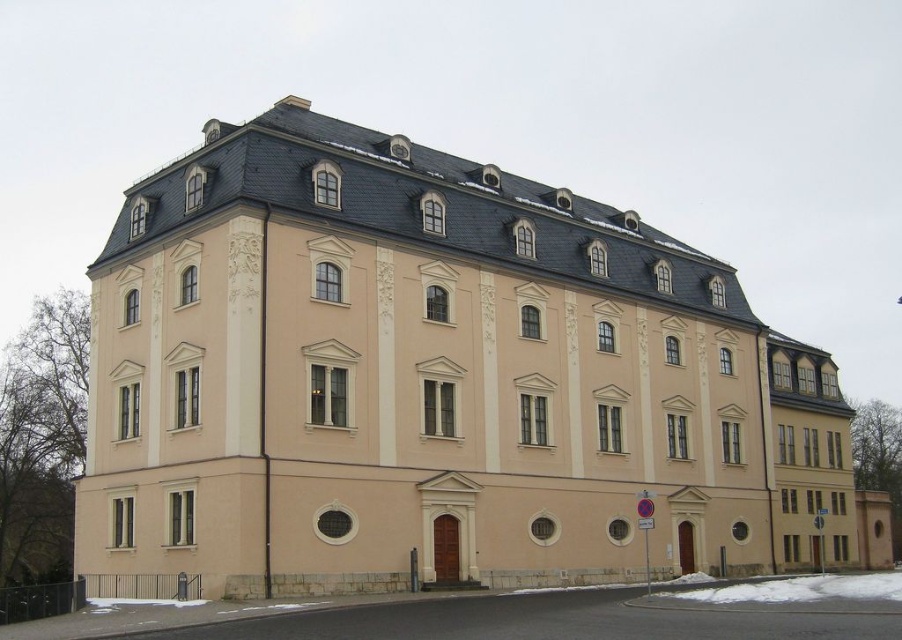
Does beige stone building at center have a lesser height compared to white powdery snow at lower center?

Incorrect, beige stone building at center's height does not fall short of white powdery snow at lower center's.

From the picture: Does beige stone building at center have a lesser width compared to white powdery snow at lower center?

No.

Is point (827, 401) behind point (775, 602)?

Yes, it is behind point (775, 602).

At what (x,y) coordinates should I click in order to perform the action: click on beige stone building at center. Please return your answer as a coordinate pair (x, y). The height and width of the screenshot is (640, 902). Looking at the image, I should click on (433, 378).